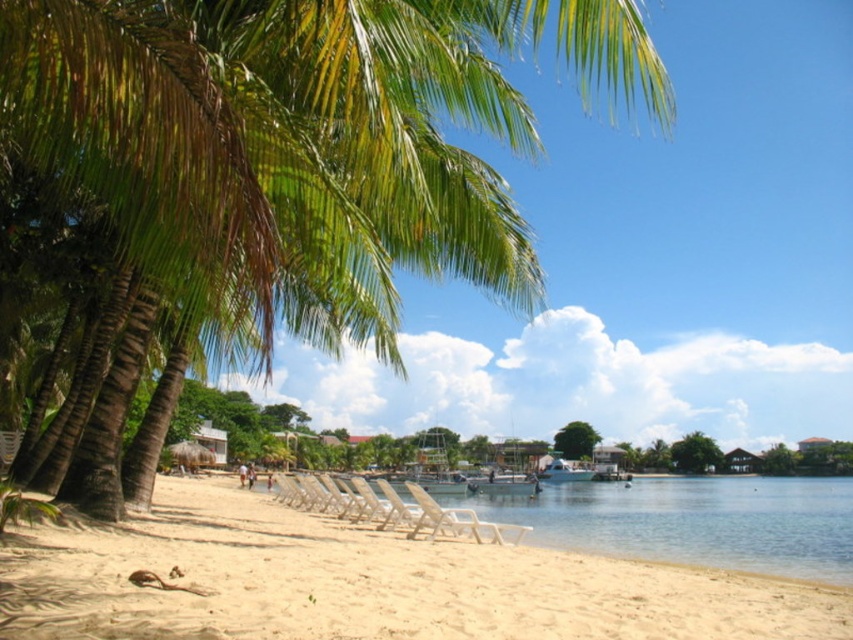
Question: In this image, where is green leafy palm tree at upper left located relative to beige sand at lower left?

Choices:
 (A) below
 (B) above

Answer: (B)

Question: Is clear water at lower center positioned behind white plastic beach chair at lower center?

Choices:
 (A) no
 (B) yes

Answer: (A)

Question: Which point appears farthest from the camera in this image?

Choices:
 (A) (360, 212)
 (B) (241, 525)
 (C) (842, 515)

Answer: (C)

Question: Considering the real-world distances, which object is closest to the green leafy palm tree at upper left?

Choices:
 (A) clear water at lower center
 (B) beige sand at lower left

Answer: (B)

Question: Which object appears farthest from the camera in this image?

Choices:
 (A) green leafy palm tree at upper left
 (B) clear water at lower center
 (C) white plastic beach chair at lower center

Answer: (C)

Question: Can you confirm if beige sand at lower left is positioned to the left of clear water at lower center?

Choices:
 (A) no
 (B) yes

Answer: (B)